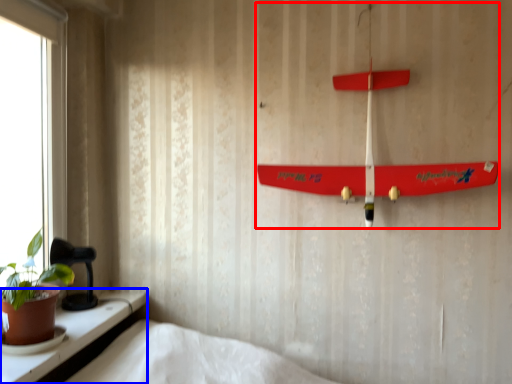
Question: Which of the following is the farthest to the observer, toy (highlighted by a red box) or window (highlighted by a blue box)?

Choices:
 (A) toy
 (B) window

Answer: (A)